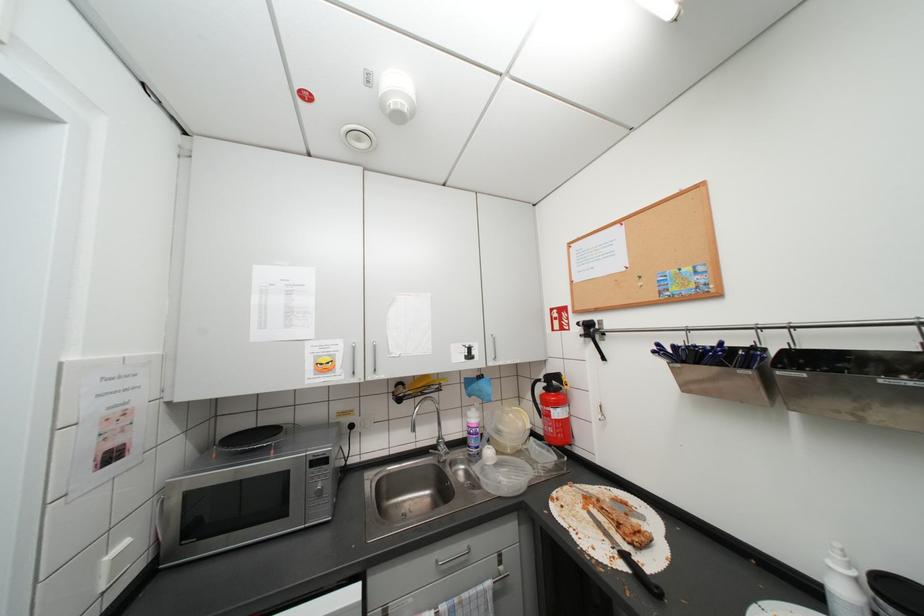
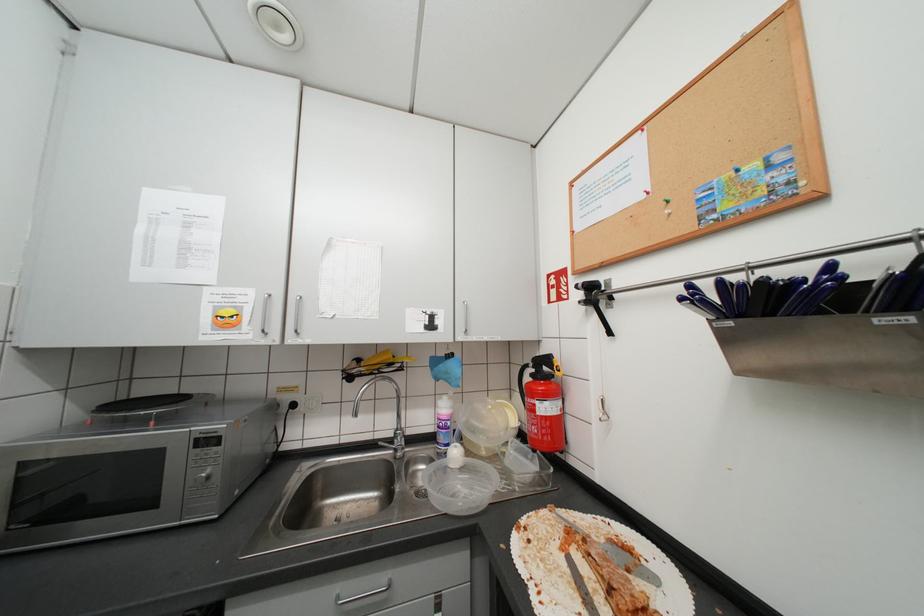
In a continuous first-person perspective shot, in which direction is the camera moving?

The cameraman moved toward right, forward.